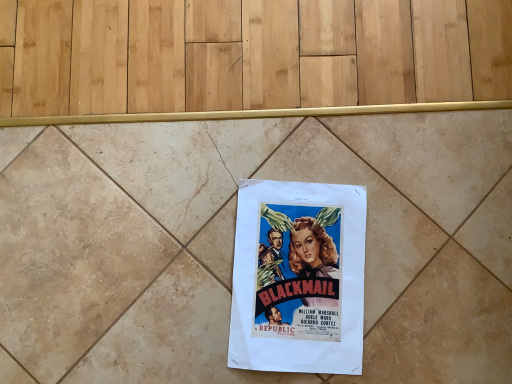
Identify the location of matte paper poster at center. (298, 278).

What do you see at coordinates (298, 278) in the screenshot? The image size is (512, 384). I see `matte paper poster at center` at bounding box center [298, 278].

Identify the location of matte paper poster at center. Image resolution: width=512 pixels, height=384 pixels. (298, 278).